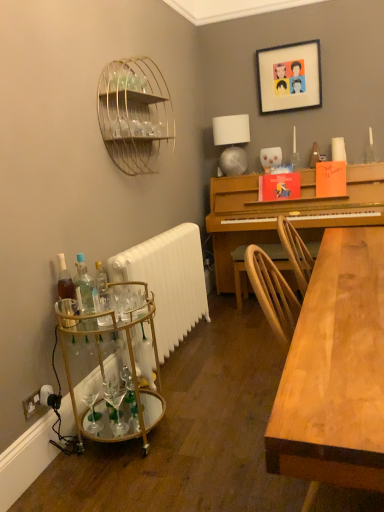
Question: From the image's perspective, is translucent glass bottles at lower left, arranged as the second bottle when viewed from the right, positioned above or below white matte radiator at lower left?

Choices:
 (A) above
 (B) below

Answer: (A)

Question: In the image, is translucent glass bottles at lower left, placed as the second bottle when sorted from left to right, positioned in front of or behind white matte radiator at lower left?

Choices:
 (A) front
 (B) behind

Answer: (A)

Question: Which is farther from the light wood table at right?

Choices:
 (A) translucent glass bottles at lower left, placed as the second bottle when sorted from left to right
 (B) gold wire shelf at upper left
 (C) translucent glass bottle at lower left, acting as the first bottle starting from the left
 (D) gold glass bar cart at left
 (E) wooden picture frame at upper center

Answer: (E)

Question: Which object is the farthest from the translucent glass bottles at lower left, placed as the second bottle when sorted from left to right?

Choices:
 (A) white matte radiator at lower left
 (B) clear glass bottle at left, which is counted as the 1th bottle, starting from the right
 (C) light wood table at right
 (D) gold wire shelf at upper left
 (E) translucent glass bottle at lower left, the 3th bottle when ordered from right to left

Answer: (D)